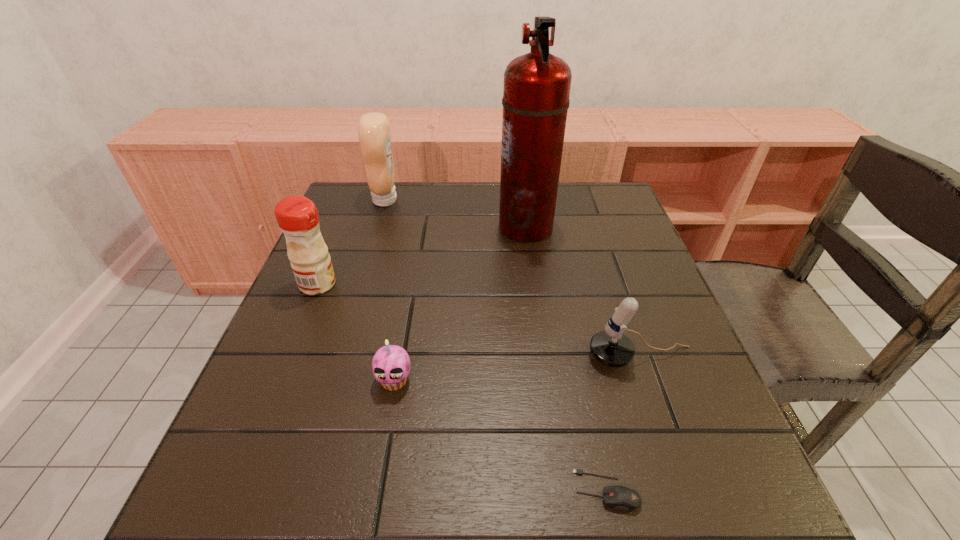
I want to click on vacant space situated 0.160m on the side of the tallest object with the handle and hose, so click(439, 227).

Find the location of a particular element. This screenshot has width=960, height=540. free space located on the side of the tallest object with the handle and hose is located at coordinates (431, 227).

Locate an element on the screen. free location located on the side of the tallest object with the handle and hose is located at coordinates (417, 227).

Locate an element on the screen. This screenshot has width=960, height=540. free space located 0.340m on the label of the fifth object from right to left is located at coordinates (516, 200).

Where is `vacant area situated on the back of the leftmost object`? vacant area situated on the back of the leftmost object is located at coordinates (348, 213).

Locate an element on the screen. vacant area located 0.180m on the back of the third shortest object is located at coordinates (614, 281).

At what (x,y) coordinates should I click in order to perform the action: click on vacant space positioned 0.200m on the face of the third object from left to right. Please return your answer as a coordinate pair (x, y). This screenshot has width=960, height=540. Looking at the image, I should click on (371, 514).

I want to click on blank space located 0.390m on the back of the mouse, so click(x=565, y=298).

Locate an element on the screen. The width and height of the screenshot is (960, 540). fire extinguisher at the far edge is located at coordinates (536, 91).

The width and height of the screenshot is (960, 540). Find the location of `condiment located in the far edge section of the desktop`. condiment located in the far edge section of the desktop is located at coordinates (374, 131).